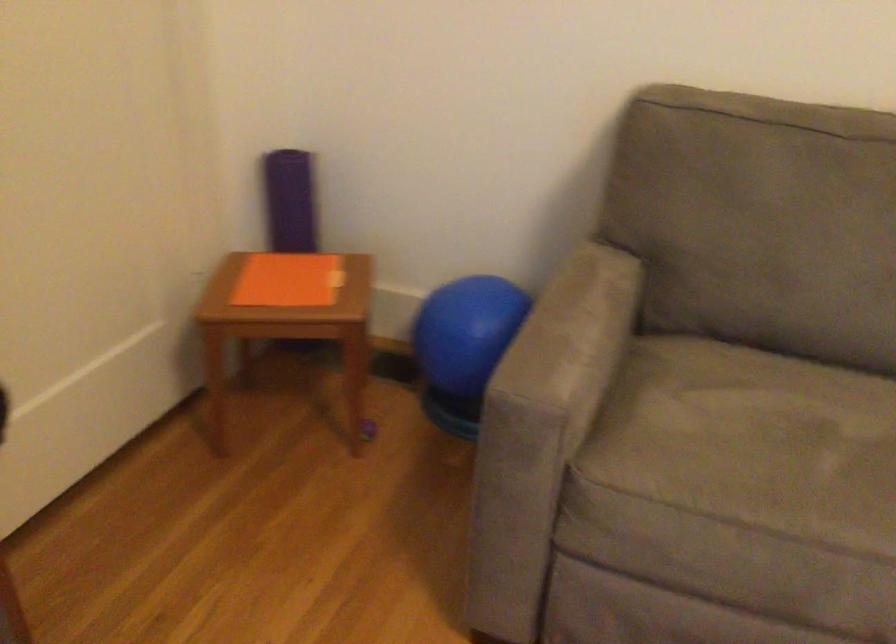
Where is `orange paper`? The height and width of the screenshot is (644, 896). orange paper is located at coordinates (288, 279).